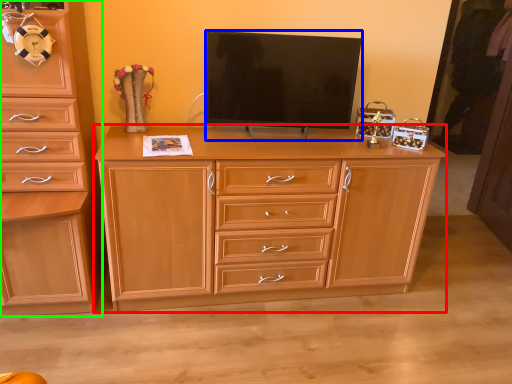
Question: Based on their relative distances, which object is nearer to chest of drawers (highlighted by a red box)? Choose from television (highlighted by a blue box) and chest of drawers (highlighted by a green box).

Choices:
 (A) television
 (B) chest of drawers

Answer: (A)